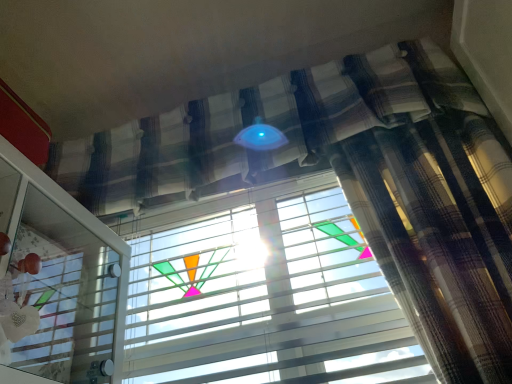
Where is `transparent glass screen door at lower left`? The image size is (512, 384). transparent glass screen door at lower left is located at coordinates (69, 296).

The height and width of the screenshot is (384, 512). Describe the element at coordinates (69, 296) in the screenshot. I see `transparent glass screen door at lower left` at that location.

This screenshot has width=512, height=384. What do you see at coordinates (265, 295) in the screenshot?
I see `white plastic blinds at center` at bounding box center [265, 295].

You are a GUI agent. You are given a task and a screenshot of the screen. Output one action in this format:
    pyautogui.click(x=<x>, y=<y>)
    Task: Click on the white plastic blinds at center
    Image resolution: width=512 pixels, height=384 pixels.
    Given the screenshot: What is the action you would take?
    pyautogui.click(x=265, y=295)

Where is `transparent glass screen door at lower left`? This screenshot has width=512, height=384. transparent glass screen door at lower left is located at coordinates (69, 296).

Considering the positions of objects white plastic blinds at center and transparent glass screen door at lower left in the image provided, who is more to the left, white plastic blinds at center or transparent glass screen door at lower left?

From the viewer's perspective, transparent glass screen door at lower left appears more on the left side.

Relative to transparent glass screen door at lower left, is white plastic blinds at center in front or behind?

Clearly, white plastic blinds at center is behind transparent glass screen door at lower left.

Considering the positions of point (395, 315) and point (32, 228), is point (395, 315) closer or farther from the camera than point (32, 228)?

Clearly, point (395, 315) is more distant from the camera than point (32, 228).

From the image's perspective, which one is positioned lower, white plastic blinds at center or transparent glass screen door at lower left?

From the image's view, white plastic blinds at center is below.

From a real-world perspective, is white plastic blinds at center on transparent glass screen door at lower left?

Yes, from a real-world perspective, white plastic blinds at center is above transparent glass screen door at lower left.

Does white plastic blinds at center have a greater width compared to transparent glass screen door at lower left?

No.

Does white plastic blinds at center have a lesser height compared to transparent glass screen door at lower left?

In fact, white plastic blinds at center may be taller than transparent glass screen door at lower left.

Between white plastic blinds at center and transparent glass screen door at lower left, which one has smaller size?

With smaller size is white plastic blinds at center.

Is white plastic blinds at center completely or partially outside of transparent glass screen door at lower left?

Yes, white plastic blinds at center is outside of transparent glass screen door at lower left.

Are white plastic blinds at center and transparent glass screen door at lower left located far from each other?

No, there isn't a large distance between white plastic blinds at center and transparent glass screen door at lower left.

Is white plastic blinds at center oriented towards transparent glass screen door at lower left?

Yes, white plastic blinds at center is oriented towards transparent glass screen door at lower left.

How different are the orientations of white plastic blinds at center and transparent glass screen door at lower left in degrees?

They differ by 90 degrees in their facing directions.

I want to click on window blind above the transparent glass screen door at lower left (from a real-world perspective), so click(x=265, y=295).

Considering the relative positions of transparent glass screen door at lower left and white plastic blinds at center in the image provided, is transparent glass screen door at lower left to the right of white plastic blinds at center from the viewer's perspective?

No, transparent glass screen door at lower left is not to the right of white plastic blinds at center.

Does transparent glass screen door at lower left come behind white plastic blinds at center?

Result: No, transparent glass screen door at lower left is closer to the camera.

Does point (92, 382) appear closer or farther from the camera than point (312, 379)?

Point (92, 382) is positioned closer to the camera compared to point (312, 379).

From the image's perspective, is transparent glass screen door at lower left beneath white plastic blinds at center?

Actually, transparent glass screen door at lower left appears above white plastic blinds at center in the image.

From a real-world perspective, is transparent glass screen door at lower left physically below white plastic blinds at center?

Indeed, from a real-world perspective, transparent glass screen door at lower left is positioned beneath white plastic blinds at center.

Does transparent glass screen door at lower left have a greater width compared to white plastic blinds at center?

Indeed, transparent glass screen door at lower left has a greater width compared to white plastic blinds at center.

Is transparent glass screen door at lower left taller than white plastic blinds at center?

Incorrect, the height of transparent glass screen door at lower left is not larger of that of white plastic blinds at center.

Can you confirm if transparent glass screen door at lower left is smaller than white plastic blinds at center?

Actually, transparent glass screen door at lower left might be larger than white plastic blinds at center.

Is transparent glass screen door at lower left positioned beyond the bounds of white plastic blinds at center?

transparent glass screen door at lower left lies outside white plastic blinds at center's area.

Does transparent glass screen door at lower left touch white plastic blinds at center?

There is a gap between transparent glass screen door at lower left and white plastic blinds at center.

Is transparent glass screen door at lower left facing away from white plastic blinds at center?

No, transparent glass screen door at lower left's orientation is not away from white plastic blinds at center.

What's the angular difference between transparent glass screen door at lower left and white plastic blinds at center's facing directions?

The angular difference between transparent glass screen door at lower left and white plastic blinds at center is 90 degrees.

Measure the distance between transparent glass screen door at lower left and white plastic blinds at center.

The distance of transparent glass screen door at lower left from white plastic blinds at center is 13.93 inches.

Where is `window blind that appears below the transparent glass screen door at lower left (from the image's perspective)`? window blind that appears below the transparent glass screen door at lower left (from the image's perspective) is located at coordinates (265, 295).

At what (x,y) coordinates should I click in order to perform the action: click on window blind behind the transparent glass screen door at lower left. Please return your answer as a coordinate pair (x, y). Looking at the image, I should click on (265, 295).

Locate an element on the screen. The height and width of the screenshot is (384, 512). screen door beneath the white plastic blinds at center (from a real-world perspective) is located at coordinates (69, 296).